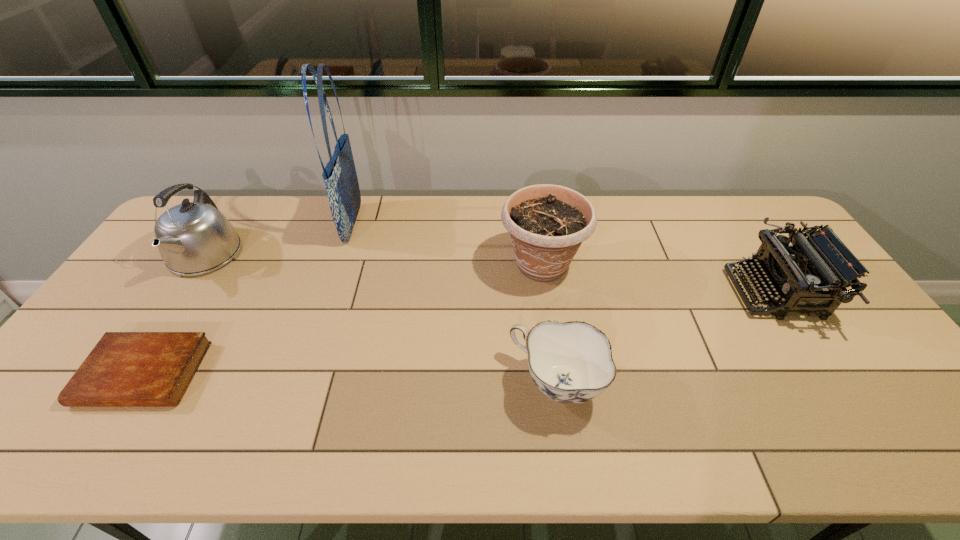
The width and height of the screenshot is (960, 540). I want to click on blank area in the image that satisfies the following two spatial constraints: 1. on the front-facing side of the third object from left to right; 2. on the left side of the flowerpot, so click(x=340, y=265).

This screenshot has width=960, height=540. What are the coordinates of `vacant region that satisfies the following two spatial constraints: 1. on the keyboard of the typewriter; 2. on the front side of the chinaware` in the screenshot? It's located at [x=833, y=384].

What are the coordinates of `vacant point that satisfies the following two spatial constraints: 1. on the keyboard of the typewriter; 2. on the spine side of the Bible` in the screenshot? It's located at (827, 374).

Find the location of `free region that satisfies the following two spatial constraints: 1. on the spine side of the second shortest object; 2. on the left side of the Bible`. free region that satisfies the following two spatial constraints: 1. on the spine side of the second shortest object; 2. on the left side of the Bible is located at coordinates (137, 384).